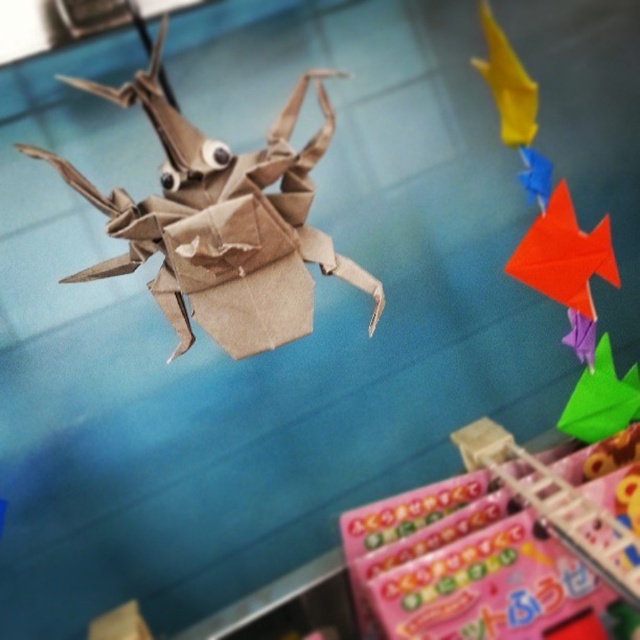
You are organizing an art exhibition and want to place a label next to the brown paper origami crab at center and the orange paper fish at upper right. Since the label must be proportional to the size of the artwork, which artwork requires a larger label?

The brown paper origami crab at center requires a larger label because it is larger in size compared to the orange paper fish at upper right.

You are an observer looking at the origami creations. There are two fish, the orange paper fish at upper right and the yellow paper fish at upper right. Which one is positioned more to the right?

The orange paper fish at upper right is positioned more to the right than the yellow paper fish at upper right.

You are a child trying to place your origami creations on a shelf. You have the brown paper origami crab at center and the yellow paper fish at upper right. Which one do you need to place higher on the shelf to avoid it touching the lower shelf?

The brown paper origami crab at center is much taller than the yellow paper fish at upper right, so you should place it higher on the shelf to avoid it touching the lower shelf.